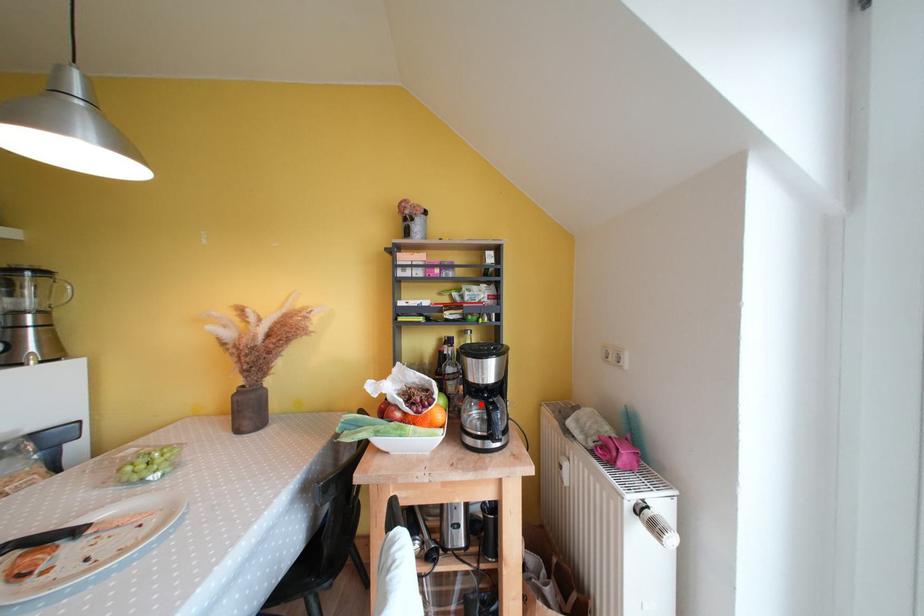
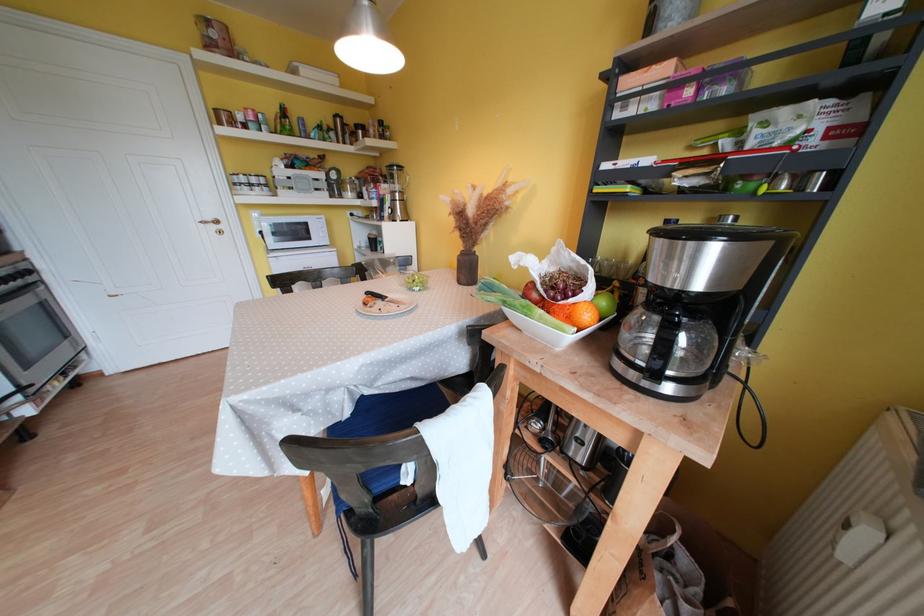
Where in the second image is the point corresponding to the highlighted location from the first image?

(663, 322)